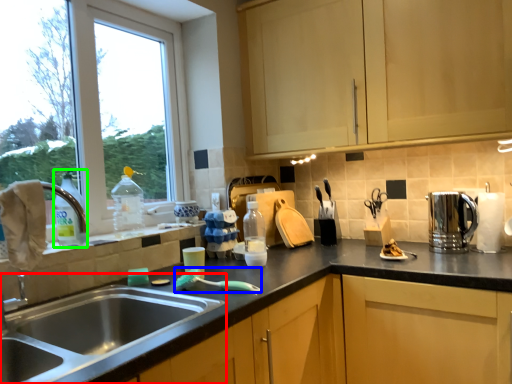
Question: Which is farther away from sink (highlighted by a red box)? brush (highlighted by a blue box) or bottle (highlighted by a green box)?

Choices:
 (A) brush
 (B) bottle

Answer: (B)